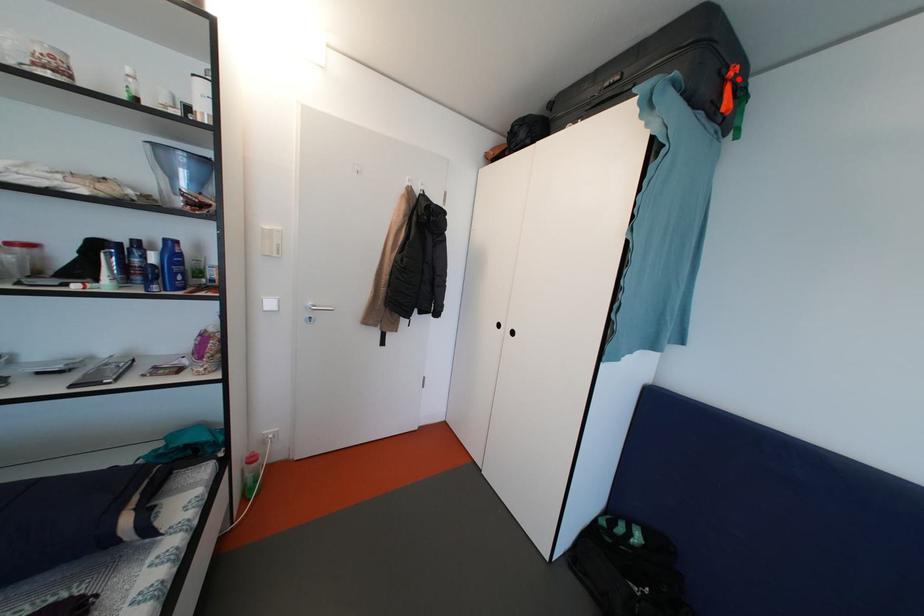
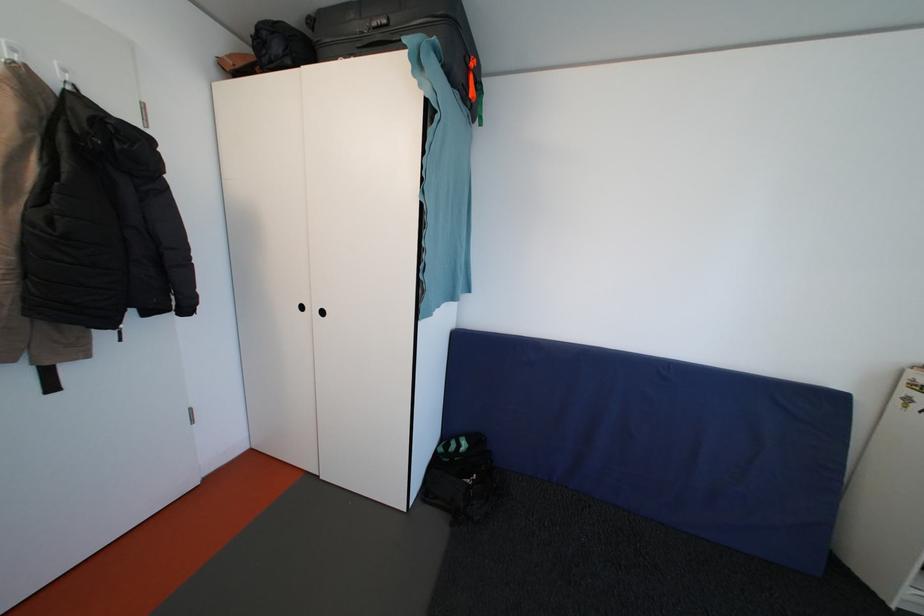
Where in the second image is the point corresponding to the highlighted location from the first image?

(479, 70)